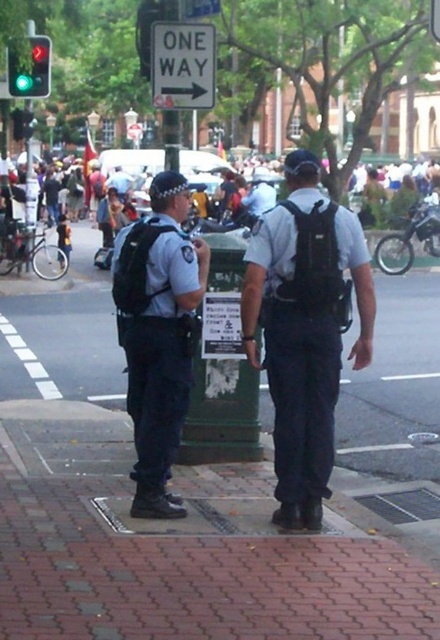
Question: Which point appears farthest from the camera in this image?

Choices:
 (A) (30, 84)
 (B) (436, 12)
 (C) (169, 35)
 (D) (167, 296)

Answer: (A)

Question: Among these points, which one is farthest from the camera?

Choices:
 (A) (304, 172)
 (B) (164, 88)
 (C) (179, 298)

Answer: (B)

Question: Does white plastic sign at upper center come behind green glass traffic light at upper left?

Choices:
 (A) no
 (B) yes

Answer: (A)

Question: Is shiny black motorcycle at right positioned behind green glass traffic light at upper left?

Choices:
 (A) no
 (B) yes

Answer: (B)

Question: Which of these objects is positioned closest to the white plastic sign at upper center?

Choices:
 (A) green glass traffic light at upper left
 (B) matte black uniform at center
 (C) white plastic one way sign at upper center
 (D) shiny black motorcycle at right

Answer: (C)

Question: Can you confirm if shiny black motorcycle at right is positioned to the left of green glass traffic light at upper left?

Choices:
 (A) yes
 (B) no

Answer: (B)